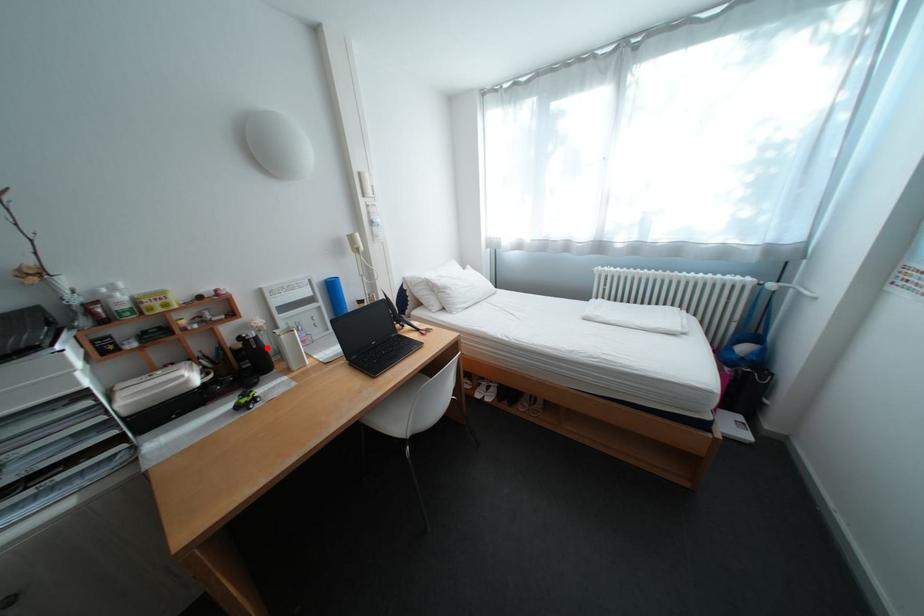
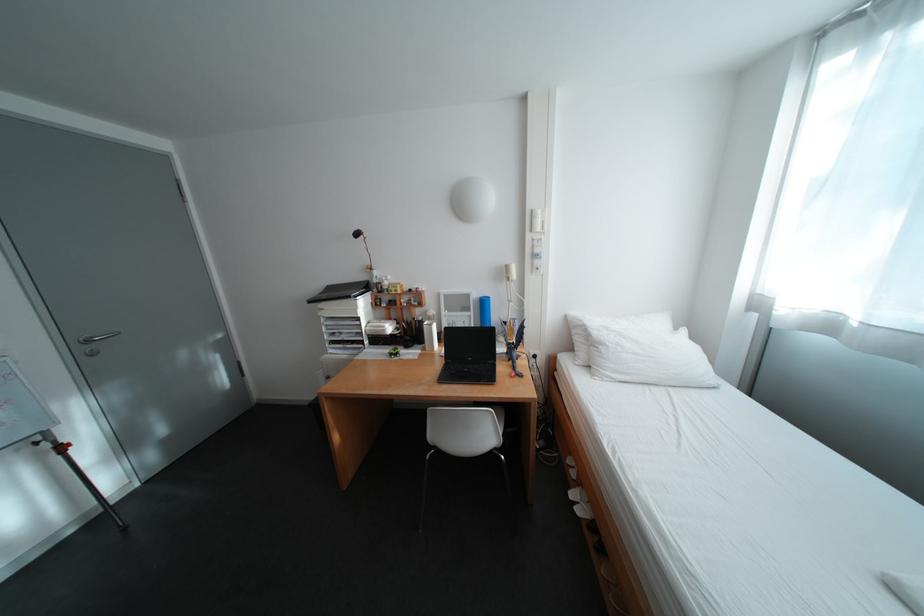
Locate, in the second image, the point that corresponds to the highlighted location in the first image.

(430, 326)